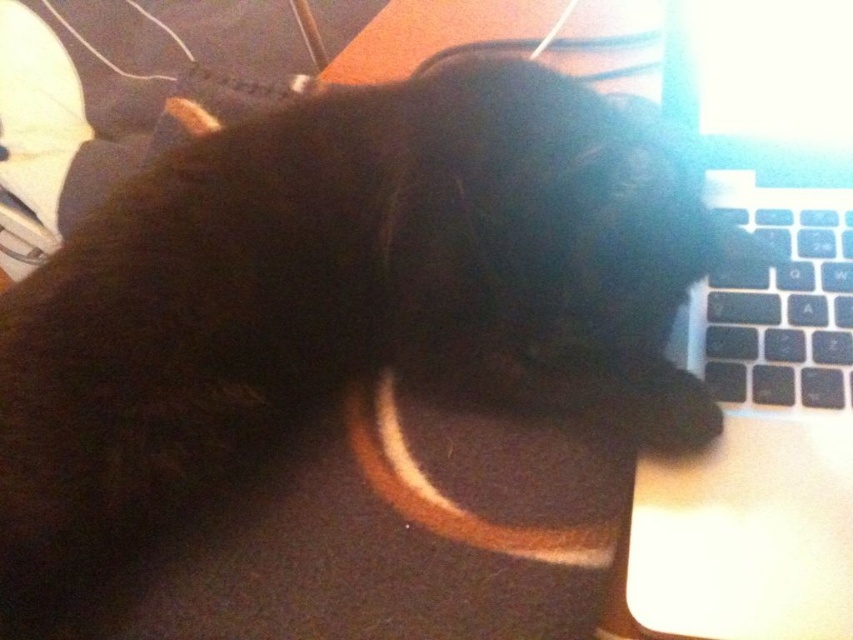
Image resolution: width=853 pixels, height=640 pixels. What do you see at coordinates (762, 339) in the screenshot?
I see `sleek black laptop at right` at bounding box center [762, 339].

Is sleek black laptop at right thinner than black matte keyboard at right?

In fact, sleek black laptop at right might be wider than black matte keyboard at right.

Between point (838, 588) and point (740, 349), which one is positioned in front?

Positioned in front is point (838, 588).

Find the location of a particular element. This screenshot has width=853, height=640. sleek black laptop at right is located at coordinates (762, 339).

Is black matte keyboard at right further to camera compared to black fur paw at lower center?

Yes, it is.

What do you see at coordinates (780, 307) in the screenshot?
I see `black matte keyboard at right` at bounding box center [780, 307].

You are a GUI agent. You are given a task and a screenshot of the screen. Output one action in this format:
    pyautogui.click(x=<x>, y=<y>)
    Task: Click on the black matte keyboard at right
    This screenshot has width=853, height=640.
    Given the screenshot: What is the action you would take?
    click(x=780, y=307)

Between point (730, 401) and point (672, 454), which one is positioned in front?

Point (672, 454) is more forward.

Who is lower down, sleek black laptop at right or black fur paw at lower center?

black fur paw at lower center is lower down.

Is point (802, 346) less distant than point (634, 419)?

No, (802, 346) is further to viewer.

This screenshot has width=853, height=640. Find the location of `sleek black laptop at right`. sleek black laptop at right is located at coordinates (762, 339).